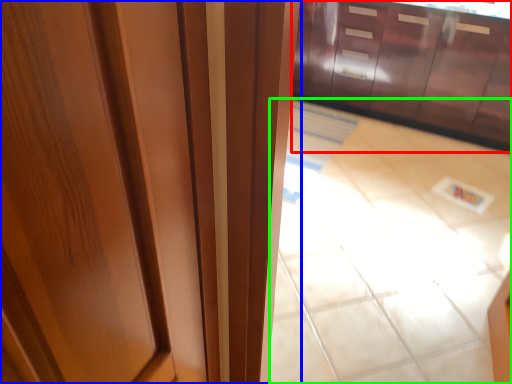
Question: Estimate the real-world distances between objects in this image. Which object is closer to cabinetry (highlighted by a red box), door (highlighted by a blue box) or tile (highlighted by a green box)?

Choices:
 (A) door
 (B) tile

Answer: (B)